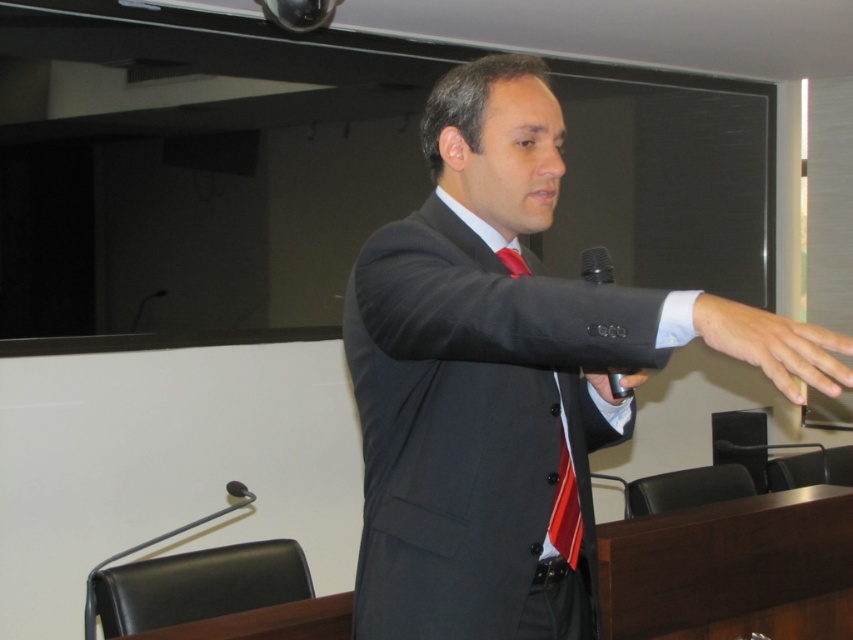
Question: Which of the following is the closest to the observer?

Choices:
 (A) matte black suit at center
 (B) metallic silver remote at center

Answer: (A)

Question: Estimate the real-world distances between objects in this image. Which object is farther from the matte black suit at center?

Choices:
 (A) smooth skin hand at right
 (B) red striped tie at center

Answer: (A)

Question: Is matte black suit at center to the right of black metallic microphone at lower left from the viewer's perspective?

Choices:
 (A) yes
 (B) no

Answer: (A)

Question: Among these points, which one is nearest to the camera?

Choices:
 (A) (595, 282)
 (B) (515, 273)

Answer: (A)

Question: Can you confirm if red striped tie at center is positioned below black metallic microphone at lower left?

Choices:
 (A) no
 (B) yes

Answer: (A)

Question: Can you confirm if smooth skin hand at right is wider than black metallic microphone at lower left?

Choices:
 (A) yes
 (B) no

Answer: (A)